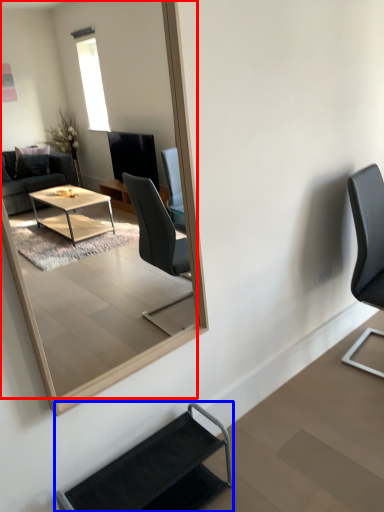
Question: Which object is further to the camera taking this photo, mirror (highlighted by a red box) or chair (highlighted by a blue box)?

Choices:
 (A) mirror
 (B) chair

Answer: (B)